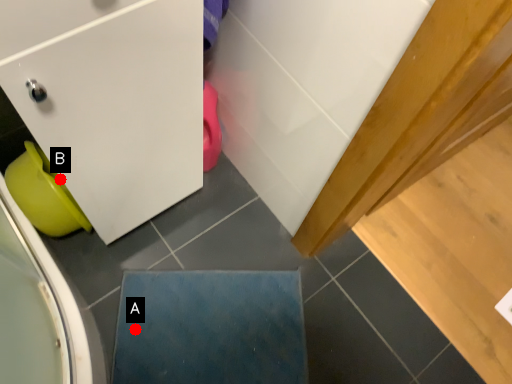
Question: Two points are circled on the image, labeled by A and B beside each circle. Which of the following is the closest to the observer?

Choices:
 (A) A is closer
 (B) B is closer

Answer: (B)